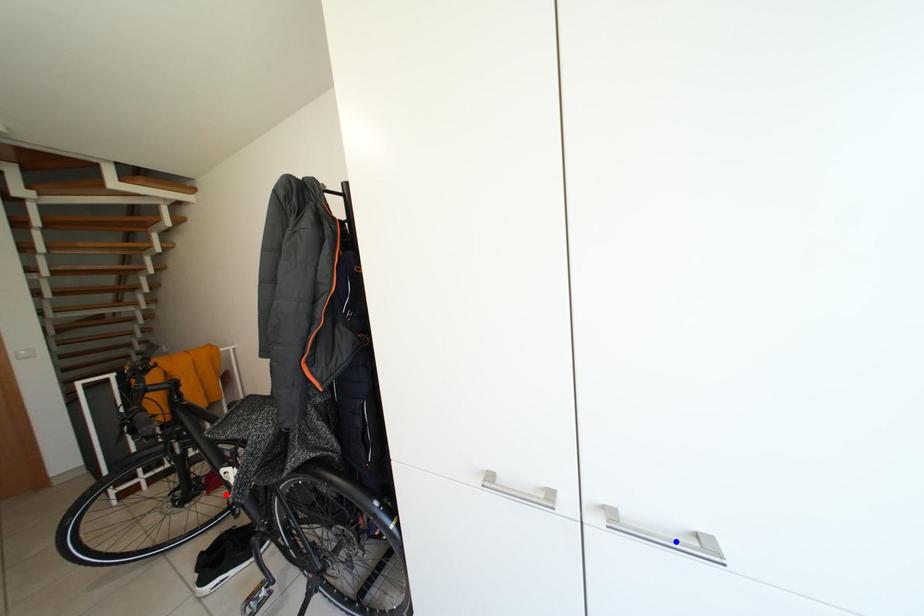
Question: Two points are marked on the image. Which point is closer to the camera?

Choices:
 (A) Blue point is closer.
 (B) Red point is closer.

Answer: (A)